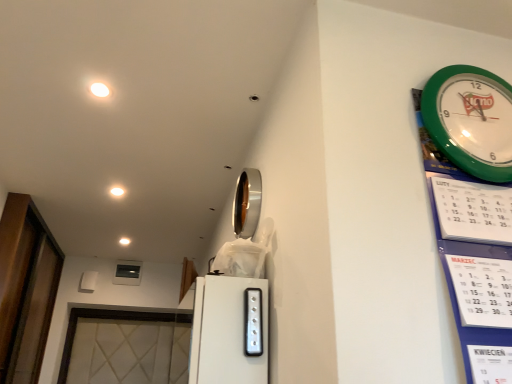
Question: From a real-world perspective, is transparent glass door at left physically above white glossy light at upper left, the 3th light in the left-to-right sequence?

Choices:
 (A) yes
 (B) no

Answer: (B)

Question: From the image's perspective, would you say transparent glass door at left is shown under white glossy light at upper left, positioned as the 3th light in back-to-front order?

Choices:
 (A) yes
 (B) no

Answer: (A)

Question: Considering the relative sizes of transparent glass door at left and white glossy light at upper left, positioned as the 3th light in back-to-front order, in the image provided, is transparent glass door at left bigger than white glossy light at upper left, positioned as the 3th light in back-to-front order,?

Choices:
 (A) yes
 (B) no

Answer: (A)

Question: Is transparent glass door at left positioned before white glossy light at upper left, which is the 3th light in bottom-to-top order?

Choices:
 (A) no
 (B) yes

Answer: (A)

Question: Would you say white glossy light at upper left, the 3th light in the left-to-right sequence, is part of transparent glass door at left's contents?

Choices:
 (A) no
 (B) yes

Answer: (A)

Question: From a real-world perspective, relative to green plastic wall clock at upper right, is transparent glass door at left vertically above or below?

Choices:
 (A) below
 (B) above

Answer: (A)

Question: Considering the positions of point (47, 286) and point (489, 162), is point (47, 286) closer or farther from the camera than point (489, 162)?

Choices:
 (A) closer
 (B) farther

Answer: (B)

Question: Is transparent glass door at left spatially inside green plastic wall clock at upper right, or outside of it?

Choices:
 (A) outside
 (B) inside

Answer: (A)

Question: Would you say transparent glass door at left is to the left or to the right of green plastic wall clock at upper right in the picture?

Choices:
 (A) left
 (B) right

Answer: (A)

Question: From the image's perspective, is white glossy light at upper left, which appears as the first light when viewed from the top, positioned above or below transparent glass door at left?

Choices:
 (A) above
 (B) below

Answer: (A)

Question: In terms of width, does white glossy light at upper left, the 3th light in the left-to-right sequence, look wider or thinner when compared to transparent glass door at left?

Choices:
 (A) thin
 (B) wide

Answer: (A)

Question: Is white glossy light at upper left, which is the first light from right to left, to the left or to the right of transparent glass door at left in the image?

Choices:
 (A) left
 (B) right

Answer: (B)

Question: From their relative heights in the image, would you say white glossy light at upper left, which is the 3th light in bottom-to-top order, is taller or shorter than transparent glass door at left?

Choices:
 (A) short
 (B) tall

Answer: (A)

Question: Considering the relative positions of transparent glass door at left and white glossy light at upper center, the third light positioned from the right, in the image provided, is transparent glass door at left to the left or to the right of white glossy light at upper center, the third light positioned from the right,?

Choices:
 (A) right
 (B) left

Answer: (B)

Question: Considering the positions of transparent glass door at left and white glossy light at upper center, the third light when ordered from top to bottom, in the image, is transparent glass door at left bigger or smaller than white glossy light at upper center, the third light when ordered from top to bottom,?

Choices:
 (A) small
 (B) big

Answer: (B)